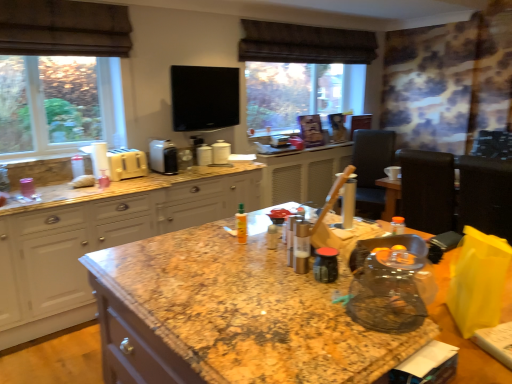
I want to click on vacant region to the left of bread dough at left, so click(x=62, y=183).